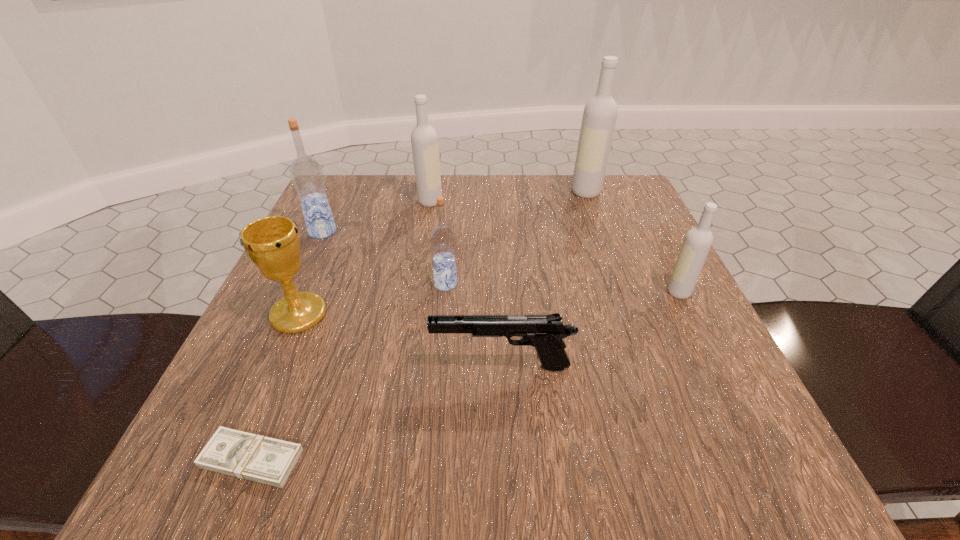
Find the location of a particular element. chalice is located at coordinates (272, 243).

I want to click on gun, so click(544, 332).

Locate an element on the screen. The width and height of the screenshot is (960, 540). the second shortest object is located at coordinates (544, 332).

Locate an element on the screen. This screenshot has height=540, width=960. money is located at coordinates (266, 460).

Locate an element on the screen. the shortest object is located at coordinates (266, 460).

The width and height of the screenshot is (960, 540). I want to click on free location located on the left of the biggest white vodka, so click(550, 192).

This screenshot has width=960, height=540. I want to click on free space located 0.050m on the back of the leftmost white vodka, so click(433, 185).

Identify the location of vacant space located 0.170m on the back of the third farthest vodka. (345, 184).

I want to click on vacant space positioned 0.120m on the left of the smallest white vodka, so click(600, 292).

The width and height of the screenshot is (960, 540). Identify the location of free space located 0.110m on the right of the smaller blue vodka. (518, 284).